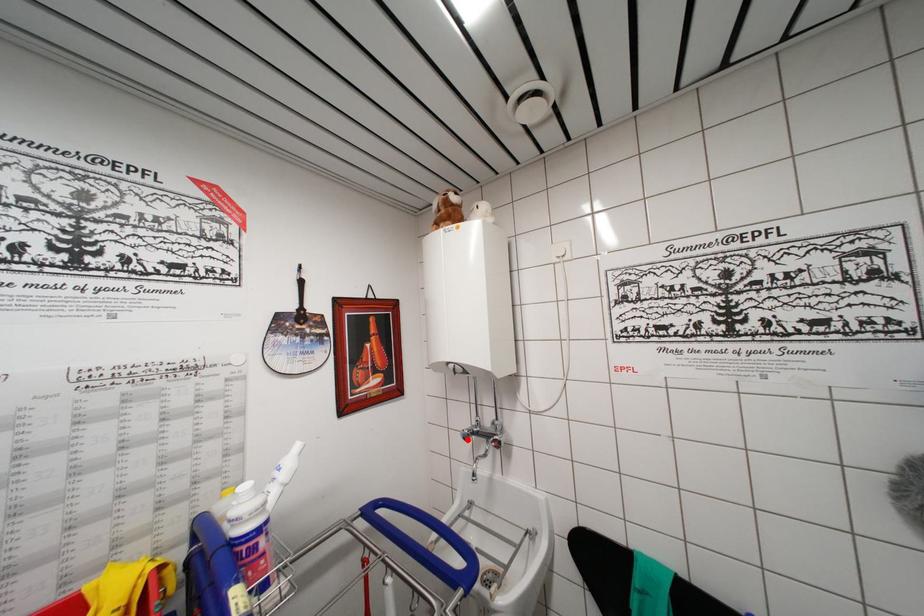
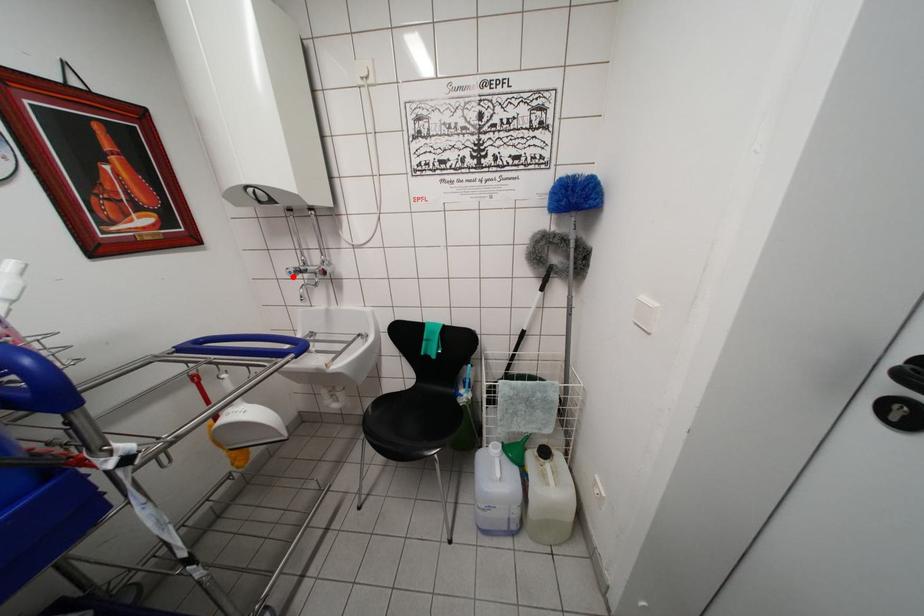
I am providing you with two images of the same scene from different viewpoints. A red point is marked on the first image and another point is marked on the second image. Are the points marked in image1 and image2 representing the same 3D position?

Yes